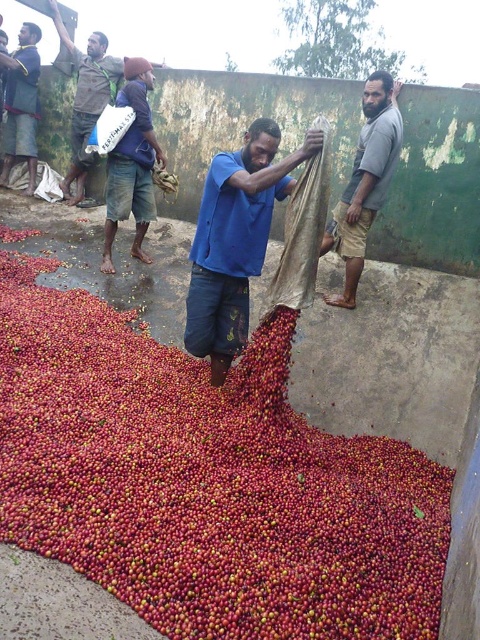
Can you confirm if blue fabric bag at upper left is positioned to the left of dark blue shirt at upper left?

No, blue fabric bag at upper left is not to the left of dark blue shirt at upper left.

Who is more forward, (x=86, y=60) or (x=27, y=195)?

Point (x=86, y=60)

Locate an element on the screen. The image size is (480, 640). blue fabric bag at upper left is located at coordinates (86, 99).

From the picture: Between red matte coffee beans at center and gray cotton shirt at center, which one is positioned lower?

red matte coffee beans at center is below.

Measure the distance from red matte coffee beans at center to gray cotton shirt at center.

red matte coffee beans at center and gray cotton shirt at center are 1.95 meters apart.

Find the location of `red matte coffee beans at center`. red matte coffee beans at center is located at coordinates (205, 481).

Can you confirm if blue cotton shirt at center is shorter than blue denim shorts at center?

Yes.

You are a GUI agent. You are given a task and a screenshot of the screen. Output one action in this format:
    pyautogui.click(x=<x>, y=<y>)
    Task: Click on the blue cotton shirt at center
    The image size is (480, 640).
    Given the screenshot: What is the action you would take?
    pyautogui.click(x=236, y=240)

Locate an element on the screen. The image size is (480, 640). blue cotton shirt at center is located at coordinates (236, 240).